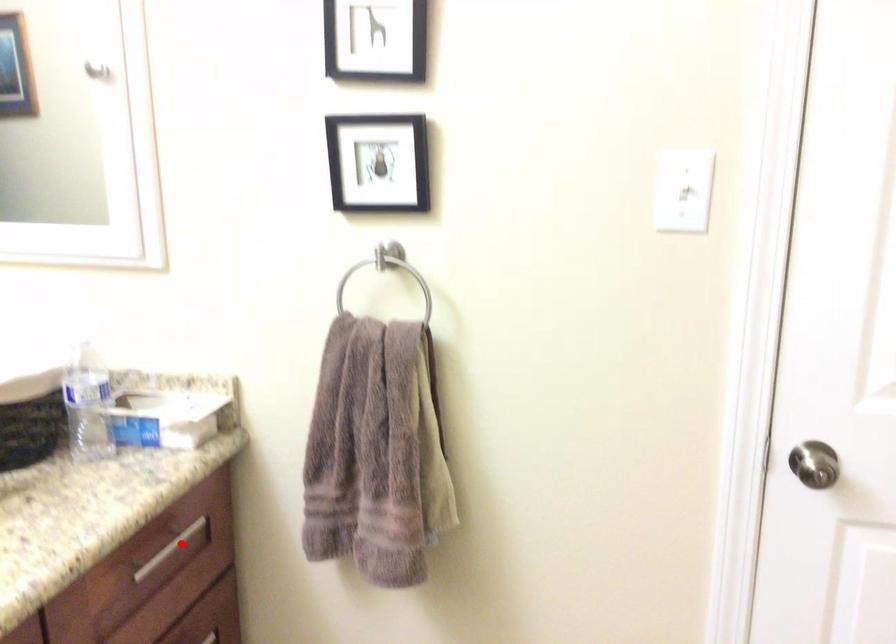
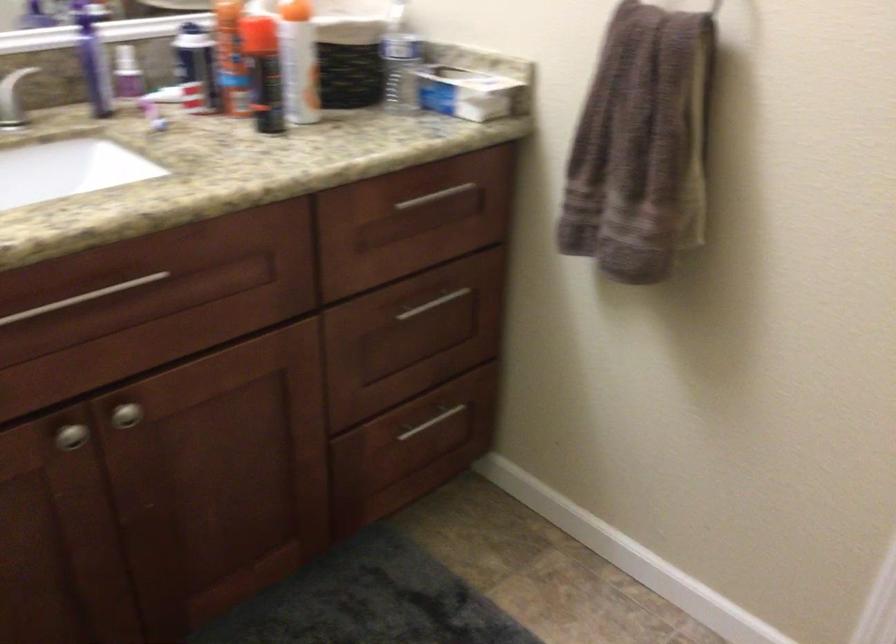
Question: I am providing you with two images of the same scene from different viewpoints. In image1, a red point is highlighted. Considering the same 3D point in image2, which of the following is correct?

Choices:
 (A) It is closer
 (B) It is farther

Answer: (B)